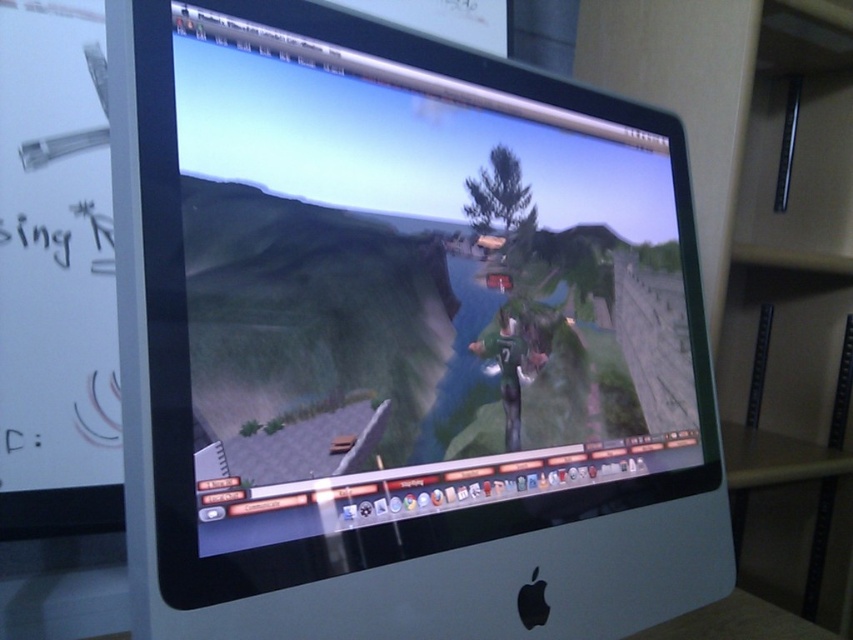
You are setting up a new workspace and need to place the satin silver monitor at center and the beige wood bookshelf at right. Based on the scene, which object is shorter?

The satin silver monitor at center is not as tall as the beige wood bookshelf at right, so the monitor is shorter.

You are setting up a desk and need to place the satin silver monitor at center and the beige wood bookshelf at right. Based on the scene, which object is positioned closer to you when standing in front of the desk?

The satin silver monitor at center is closer to the viewer than the beige wood bookshelf at right, so when standing in front of the desk, the satin silver monitor at center would be positioned closer to you.

You are playing a video game on an Apple iMac monitor and want to know how far the point at coordinates (384, 243) is from your view. Can you determine the distance?

The point at coordinates (384, 243) is 18.87 inches away from the camera, so the distance from your view is 18.87 inches.